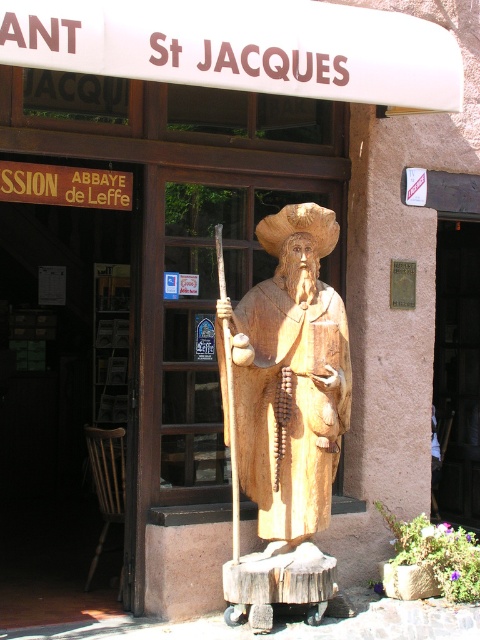
Can you confirm if wooden statue at center is positioned above smooth stone door at center?

Indeed, wooden statue at center is positioned over smooth stone door at center.

Does wooden statue at center have a greater height compared to smooth stone door at center?

Incorrect, wooden statue at center's height is not larger of smooth stone door at center's.

Image resolution: width=480 pixels, height=640 pixels. Describe the element at coordinates (290, 378) in the screenshot. I see `wooden statue at center` at that location.

Locate an element on the screen. This screenshot has height=640, width=480. wooden statue at center is located at coordinates (290, 378).